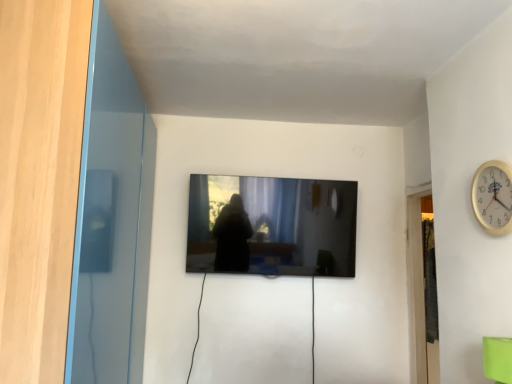
This screenshot has height=384, width=512. In order to click on gold metallic wall clock at upper right in this screenshot , I will do `click(493, 197)`.

In order to face green matte cup at lower right, should I rotate leftwards or rightwards?

You should look right and rotate roughly 31.603 degrees.

Locate an element on the screen. This screenshot has width=512, height=384. transparent glass door at left is located at coordinates (111, 218).

Is transparent glass door at left oriented away from matte black tv at center?

transparent glass door at left does not have its back to matte black tv at center.

Which object is closer to the camera, transparent glass door at left or matte black tv at center?

Positioned in front is transparent glass door at left.

Is point (93, 143) closer to camera compared to point (301, 261)?

Yes, point (93, 143) is in front of point (301, 261).

Does green matte cup at lower right have a lesser width compared to matte black tv at center?

Indeed, green matte cup at lower right has a lesser width compared to matte black tv at center.

Considering the positions of objects green matte cup at lower right and matte black tv at center in the image provided, who is more to the left, green matte cup at lower right or matte black tv at center?

matte black tv at center.

Is green matte cup at lower right touching matte black tv at center?

No, green matte cup at lower right is not next to matte black tv at center.

Is green matte cup at lower right located outside matte black tv at center?

That's correct, green matte cup at lower right is outside of matte black tv at center.

Based on the photo, which is closer, (239,196) or (490,365)?

Point (239,196) is positioned farther from the camera compared to point (490,365).

From the picture: Is matte black tv at center positioned before green matte cup at lower right?

No.

Is green matte cup at lower right oriented away from transparent glass door at left?

green matte cup at lower right is not turned away from transparent glass door at left.

How far apart are green matte cup at lower right and transparent glass door at left?

They are 1.57 meters apart.

Is there a large distance between green matte cup at lower right and transparent glass door at left?

Yes, green matte cup at lower right and transparent glass door at left are located far from each other.

From the image's perspective, relative to transparent glass door at left, is green matte cup at lower right above or below?

Clearly, from the image's perspective, green matte cup at lower right is below transparent glass door at left.

Is green matte cup at lower right positioned with its back to gold metallic wall clock at upper right?

No.

Is gold metallic wall clock at upper right a part of green matte cup at lower right?

No, gold metallic wall clock at upper right is located outside of green matte cup at lower right.

This screenshot has height=384, width=512. Identify the location of furniture in front of the gold metallic wall clock at upper right. (497, 359).

Can you confirm if green matte cup at lower right is shorter than gold metallic wall clock at upper right?

Indeed, green matte cup at lower right has a lesser height compared to gold metallic wall clock at upper right.

Would you say gold metallic wall clock at upper right is inside or outside green matte cup at lower right?

gold metallic wall clock at upper right is not enclosed by green matte cup at lower right.

How many degrees apart are the facing directions of gold metallic wall clock at upper right and green matte cup at lower right?

The angular difference between gold metallic wall clock at upper right and green matte cup at lower right is 0.523 degrees.

From the image's perspective, between gold metallic wall clock at upper right and green matte cup at lower right, which one is located above?

From the image's view, gold metallic wall clock at upper right is above.

Considering the positions of objects gold metallic wall clock at upper right and green matte cup at lower right in the image provided, who is more to the right, gold metallic wall clock at upper right or green matte cup at lower right?

From the viewer's perspective, gold metallic wall clock at upper right appears more on the right side.

Who is smaller, gold metallic wall clock at upper right or matte black tv at center?

gold metallic wall clock at upper right is smaller.

Which of these two, gold metallic wall clock at upper right or matte black tv at center, is wider?

Wider between the two is matte black tv at center.

Locate an element on the screen. television beneath the gold metallic wall clock at upper right (from a real-world perspective) is located at coordinates (273, 226).

Which is behind, point (502, 206) or point (347, 238)?

Positioned behind is point (347, 238).

The width and height of the screenshot is (512, 384). Find the location of `television behind the transparent glass door at left`. television behind the transparent glass door at left is located at coordinates (273, 226).

The width and height of the screenshot is (512, 384). I want to click on television lying above the green matte cup at lower right (from the image's perspective), so click(273, 226).

Looking at the image, which one is located closer to gold metallic wall clock at upper right, transparent glass door at left or matte black tv at center?

matte black tv at center is closer to gold metallic wall clock at upper right.

Based on their spatial positions, is green matte cup at lower right or transparent glass door at left further from matte black tv at center?

green matte cup at lower right.

Looking at the image, which one is located closer to transparent glass door at left, gold metallic wall clock at upper right or matte black tv at center?

The object closer to transparent glass door at left is matte black tv at center.

Based on the photo, from the image, which object appears to be farther from green matte cup at lower right, transparent glass door at left or matte black tv at center?

The object further to green matte cup at lower right is transparent glass door at left.

When comparing their distances from transparent glass door at left, does matte black tv at center or gold metallic wall clock at upper right seem further?

Among the two, gold metallic wall clock at upper right is located further to transparent glass door at left.

Estimate the real-world distances between objects in this image. Which object is closer to green matte cup at lower right, gold metallic wall clock at upper right or transparent glass door at left?

Based on the image, gold metallic wall clock at upper right appears to be nearer to green matte cup at lower right.

Based on the photo, from the image, which object appears to be nearer to matte black tv at center, gold metallic wall clock at upper right or transparent glass door at left?

The object closer to matte black tv at center is transparent glass door at left.

Estimate the real-world distances between objects in this image. Which object is closer to gold metallic wall clock at upper right, matte black tv at center or transparent glass door at left?

matte black tv at center.

What are the coordinates of `furniture between transparent glass door at left and gold metallic wall clock at upper right from left to right` in the screenshot? It's located at (497, 359).

Where is `television located between transparent glass door at left and gold metallic wall clock at upper right in the left-right direction`? This screenshot has height=384, width=512. television located between transparent glass door at left and gold metallic wall clock at upper right in the left-right direction is located at coordinates (273, 226).

Find the location of a particular element. The height and width of the screenshot is (384, 512). wall clock between green matte cup at lower right and matte black tv at center from front to back is located at coordinates (493, 197).

Identify the location of television between transparent glass door at left and green matte cup at lower right from left to right. (273, 226).